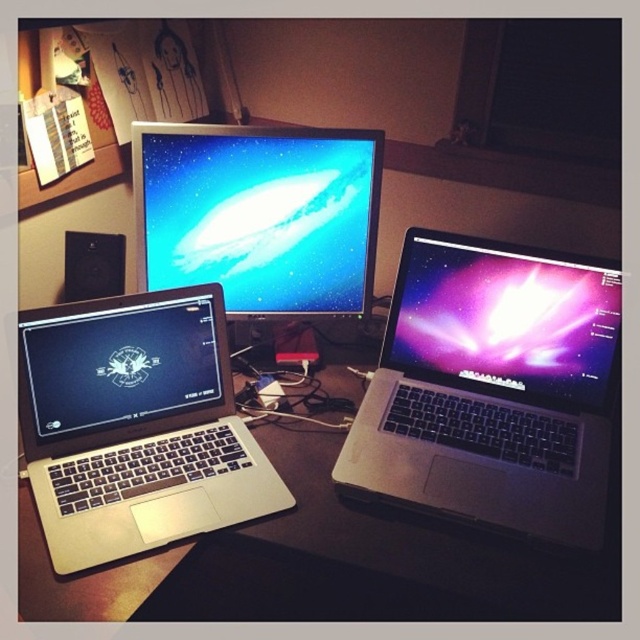
Question: Which object is farther from the camera taking this photo?

Choices:
 (A) silver metallic laptop at left
 (B) glossy metallic laptop at center right

Answer: (B)

Question: Among these points, which one is farthest from the camera?

Choices:
 (A) (584, 422)
 (B) (544, 385)
 (C) (112, 288)

Answer: (C)

Question: Is matte black laptop at lower left positioned at the back of black matte speaker at left?

Choices:
 (A) no
 (B) yes

Answer: (A)

Question: Is satin silver laptop at center to the right of silver metallic laptop at left from the viewer's perspective?

Choices:
 (A) no
 (B) yes

Answer: (B)

Question: Can you confirm if matte plastic monitor at center is positioned to the right of black matte speaker at left?

Choices:
 (A) no
 (B) yes

Answer: (B)

Question: Among these points, which one is nearest to the camera?

Choices:
 (A) (540, 614)
 (B) (182, 308)
 (C) (260, 486)

Answer: (A)